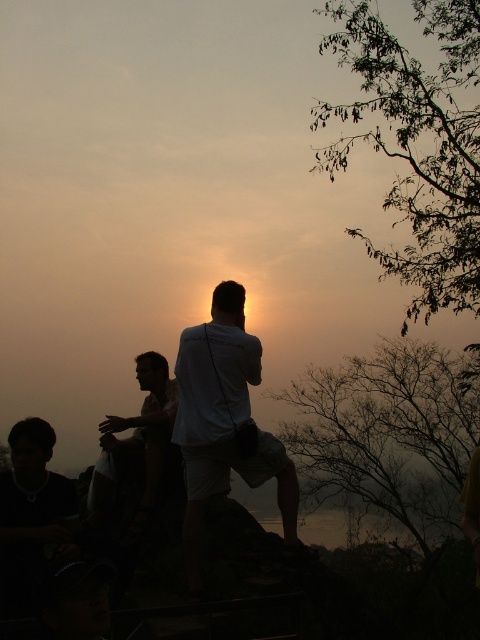
You are a photographer trying to capture the sunset scene. You notice two people in the foreground with a white matte shirt at center and a light brown fabric shirt at center. Which one is positioned higher in the frame?

The white matte shirt at center is positioned higher than the light brown fabric shirt at center.

You are a photographer trying to capture the sunset scene. You notice two people in the foreground wearing a white matte shirt at center and a light brown fabric shirt at center. Which one appears to take up more horizontal space in the photo?

The white matte shirt at center might be wider than light brown fabric shirt at center, so it likely takes up more horizontal space in the photo.

You are standing at the point marked by the coordinates point [225,417]. Looking towards the sunset, which direction should you face to see the silhouetted figures?

The white matte shirt at center is represented by point [225,417]. Since the silhouetted figures are in the foreground on the rocky outcrop or hillside, facing towards the horizon where the sun is setting would allow you to see them in front of you. Therefore, you should face towards the sunset direction to see the silhouetted figures, including the white matte shirt at center.